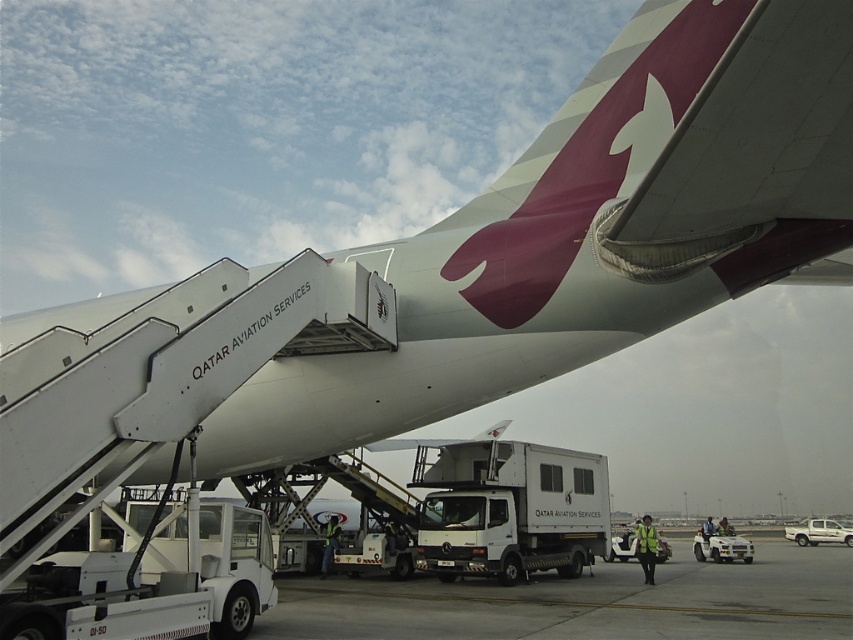
Is point (22, 577) in front of point (822, 522)?

Yes.

Does white matte truck at lower left have a greater width compared to white matte truck at lower right?

Correct, the width of white matte truck at lower left exceeds that of white matte truck at lower right.

Is point (194, 534) in front of point (804, 525)?

Yes, point (194, 534) is in front of point (804, 525).

Where is `white matte truck at lower left`? white matte truck at lower left is located at coordinates (152, 579).

Is point (184, 568) positioned behind point (473, 448)?

That is False.

Does point (229, 625) come closer to viewer compared to point (523, 449)?

Yes, point (229, 625) is in front of point (523, 449).

You are a GUI agent. You are given a task and a screenshot of the screen. Output one action in this format:
    pyautogui.click(x=<x>, y=<y>)
    Task: Click on the white matte truck at lower left
    Image resolution: width=853 pixels, height=640 pixels.
    Given the screenshot: What is the action you would take?
    pyautogui.click(x=152, y=579)

Between white matte truck at center and white matte truck at lower right, which one has more height?

With more height is white matte truck at center.

Who is higher up, white matte truck at center or white matte truck at lower right?

white matte truck at center is higher up.

The image size is (853, 640). Find the location of `white matte truck at center`. white matte truck at center is located at coordinates (509, 509).

Where is `white matte truck at center`? The height and width of the screenshot is (640, 853). white matte truck at center is located at coordinates (509, 509).